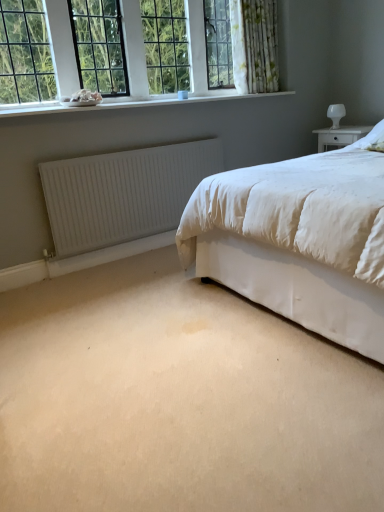
Find the location of a particular element. vacant region in front of white matte radiator at lower left is located at coordinates [137, 300].